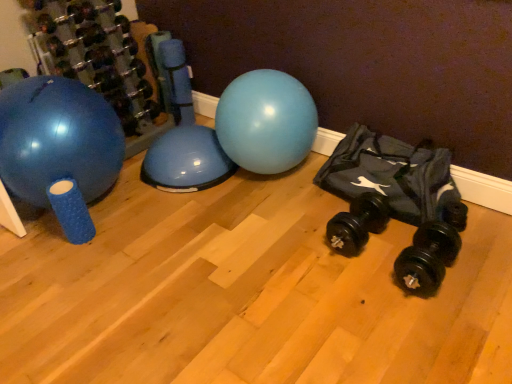
Question: Can you confirm if black rubber dumbbell at lower right, which ranks as the first dumbbell in front-to-back order, is shorter than blue rubber ball at left?

Choices:
 (A) no
 (B) yes

Answer: (B)

Question: From a real-world perspective, is black rubber dumbbell at lower right, marked as the third dumbbell in a back-to-front arrangement, located higher than blue rubber ball at left?

Choices:
 (A) no
 (B) yes

Answer: (A)

Question: Is black rubber dumbbell at lower right, which ranks as the first dumbbell in front-to-back order, touching blue rubber ball at left?

Choices:
 (A) no
 (B) yes

Answer: (A)

Question: Is black rubber dumbbell at lower right, the first dumbbell in the right-to-left sequence, positioned with its back to blue rubber ball at left?

Choices:
 (A) yes
 (B) no

Answer: (B)

Question: Can you confirm if black rubber dumbbell at lower right, the first dumbbell in the right-to-left sequence, is wider than blue rubber ball at left?

Choices:
 (A) yes
 (B) no

Answer: (B)

Question: From the image's perspective, is black rubber dumbbell at lower right, positioned as the first dumbbell in bottom-to-top order, on top of blue rubber ball at left?

Choices:
 (A) yes
 (B) no

Answer: (B)

Question: Is black rubber dumbbell at left, arranged as the 1th dumbbell when viewed from the left, to the left of black rubber dumbbell at lower right, the second dumbbell viewed from the front, from the viewer's perspective?

Choices:
 (A) no
 (B) yes

Answer: (B)

Question: From the image's perspective, is black rubber dumbbell at left, the third dumbbell when ordered from front to back, beneath black rubber dumbbell at lower right, acting as the 2th dumbbell starting from the back?

Choices:
 (A) no
 (B) yes

Answer: (A)

Question: Can black rubber dumbbell at lower right, positioned as the 2th dumbbell in bottom-to-top order, be found inside black rubber dumbbell at left, the third dumbbell when ordered from front to back?

Choices:
 (A) no
 (B) yes

Answer: (A)

Question: From the image's perspective, is black rubber dumbbell at left, the first dumbbell when ordered from back to front, above black rubber dumbbell at lower right, the second dumbbell viewed from the front?

Choices:
 (A) no
 (B) yes

Answer: (B)

Question: Does black rubber dumbbell at left, the first dumbbell when ordered from back to front, have a smaller size compared to black rubber dumbbell at lower right, acting as the 2th dumbbell starting from the back?

Choices:
 (A) yes
 (B) no

Answer: (B)

Question: Does black rubber dumbbell at left, the 3th dumbbell viewed from the right, have a lesser height compared to black rubber dumbbell at lower right, acting as the second dumbbell starting from the right?

Choices:
 (A) no
 (B) yes

Answer: (A)

Question: Are blue rubber ball at left and black fabric bean bag at right far apart?

Choices:
 (A) yes
 (B) no

Answer: (A)